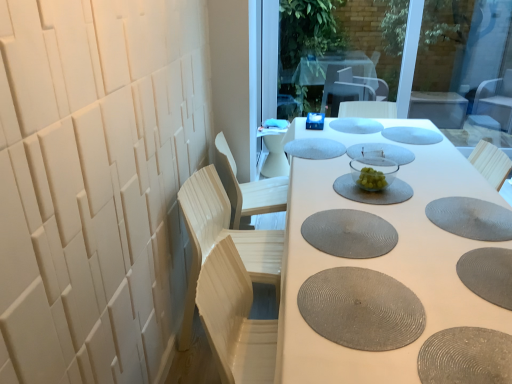
Identify the location of vacant space that is in between gray textured placemat at lower right, the eighth manhole cover in the back-to-front sequence, and light blue fabric cushion at center, placed as the 8th manhole cover when sorted from front to back. The image size is (512, 384). (394, 204).